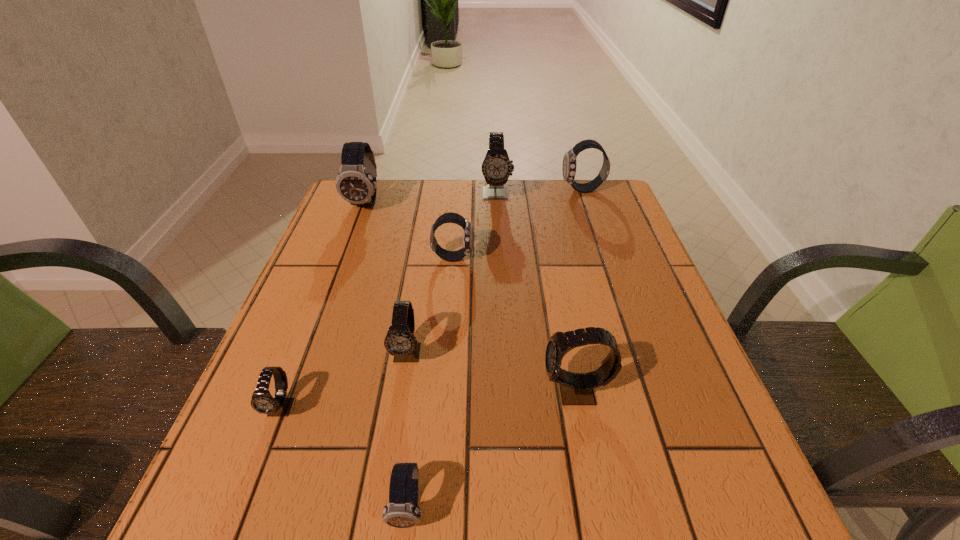
Locate which gray watch ranks second in proximity to the second gray watch from left to right. Please provide its 2D coordinates. Your answer should be formatted as a tuple, i.e. [(x, y)], where the tuple contains the x and y coordinates of a point satisfying the conditions above.

[(576, 389)]

I want to click on dark watch identified as the closest to the nearest object, so 451,256.

This screenshot has width=960, height=540. In order to click on dark watch that is the closest to the rightmost watch in this screenshot , I will do `click(451, 256)`.

The width and height of the screenshot is (960, 540). In order to click on vacant region that satisfies the following two spatial constraints: 1. on the face of the fourth farthest watch; 2. on the face of the nearest dark watch in this screenshot , I will do `click(434, 507)`.

You are a GUI agent. You are given a task and a screenshot of the screen. Output one action in this format:
    pyautogui.click(x=<x>, y=<y>)
    Task: Click on the vacant area that satisfies the following two spatial constraints: 1. on the face of the rightmost dark watch; 2. on the face of the smallest gray watch
    
    Given the screenshot: What is the action you would take?
    pyautogui.click(x=658, y=408)